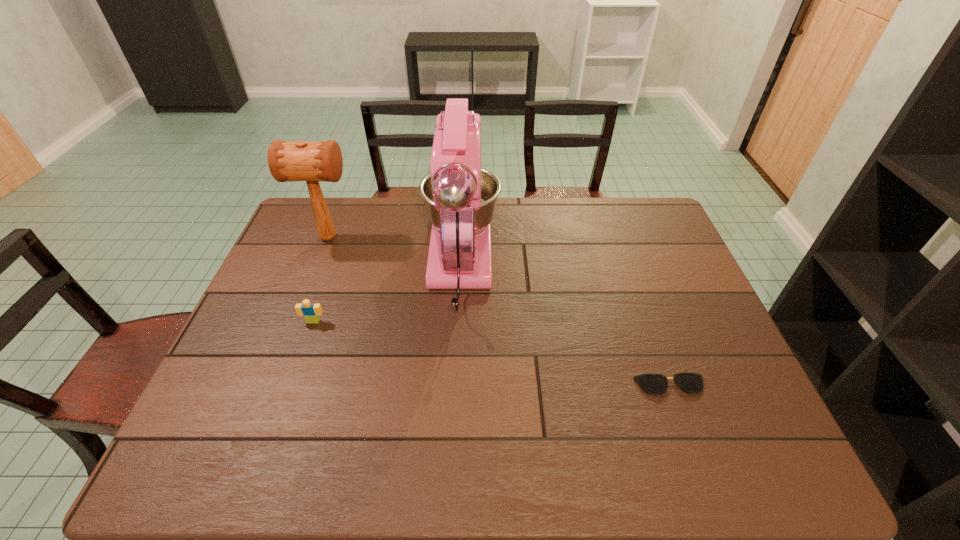
The height and width of the screenshot is (540, 960). Find the location of `the second object from right to left`. the second object from right to left is located at coordinates (460, 197).

The width and height of the screenshot is (960, 540). In order to click on mixer in this screenshot , I will do `click(460, 197)`.

Image resolution: width=960 pixels, height=540 pixels. Find the location of `mallet`. mallet is located at coordinates (312, 162).

Find the location of `the third tallest object`. the third tallest object is located at coordinates (311, 312).

Locate an element on the screen. The width and height of the screenshot is (960, 540). the rightmost object is located at coordinates (656, 384).

Where is `spectacles`? The width and height of the screenshot is (960, 540). spectacles is located at coordinates (656, 384).

Locate an element on the screen. The width and height of the screenshot is (960, 540). free region located 0.060m on the face of the mixer is located at coordinates (464, 203).

You are a GUI agent. You are given a task and a screenshot of the screen. Output one action in this format:
    pyautogui.click(x=<x>, y=<y>)
    Task: Click on the blank space located 0.090m on the face of the mixer
    The width and height of the screenshot is (960, 540).
    Given the screenshot: What is the action you would take?
    pyautogui.click(x=464, y=199)

This screenshot has height=540, width=960. Find the location of `free space located 0.200m on the strike surface of the second tallest object`. free space located 0.200m on the strike surface of the second tallest object is located at coordinates (418, 238).

You are a GUI agent. You are given a task and a screenshot of the screen. Output one action in this format:
    pyautogui.click(x=<x>, y=<y>)
    Task: Click on the vacant area situated 0.100m on the face of the second shortest object
    
    Given the screenshot: What is the action you would take?
    pyautogui.click(x=302, y=354)